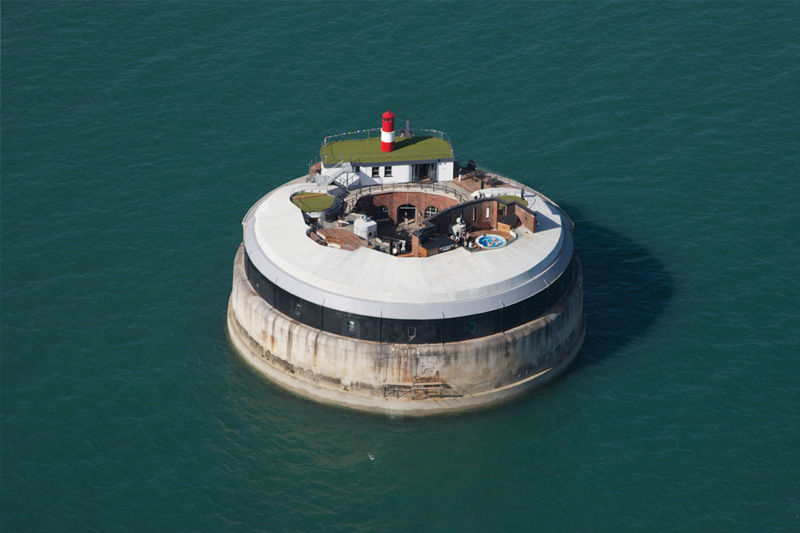
The image size is (800, 533). I want to click on tables, so click(433, 389), click(396, 385).